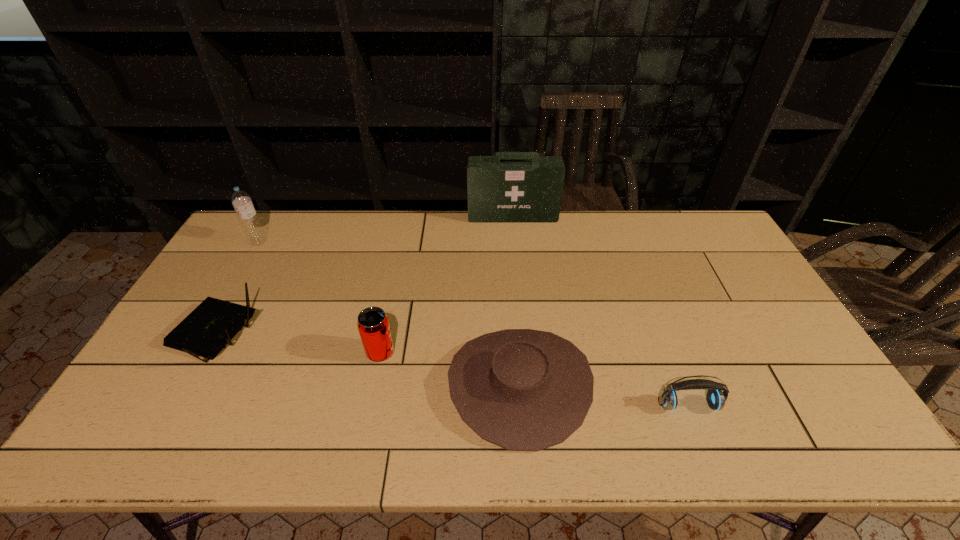
At what (x,y) coordinates should I click in order to perform the action: click on vacant space in between the router and the cowboy hat. Please return your answer as a coordinate pair (x, y). This screenshot has width=960, height=540. Looking at the image, I should click on (367, 361).

The height and width of the screenshot is (540, 960). Find the location of `free space between the fifth shortest object and the soda can`. free space between the fifth shortest object and the soda can is located at coordinates (320, 297).

The image size is (960, 540). What are the coordinates of `free space between the cowboy hat and the router` in the screenshot? It's located at (367, 361).

The image size is (960, 540). In order to click on object that can be found as the closest to the cowboy hat in this screenshot , I will do `click(373, 325)`.

Locate which object is the second closest to the fourth shortest object. Please provide its 2D coordinates. Your answer should be formatted as a tuple, i.e. [(x, y)], where the tuple contains the x and y coordinates of a point satisfying the conditions above.

[(211, 326)]

Locate an element on the screen. vacant space that satisfies the following two spatial constraints: 1. on the front side of the soda can; 2. on the left side of the router is located at coordinates (204, 353).